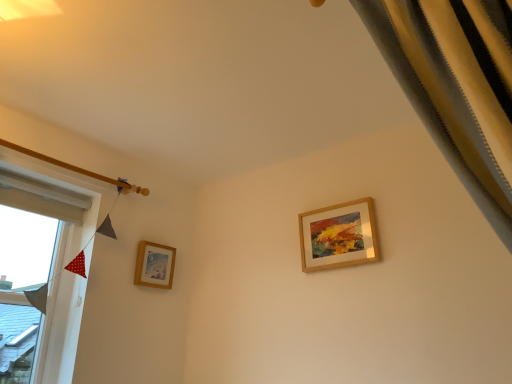
Looking at this image, measure the distance between wooden picture frame at lower left, the second picture frame positioned from the front, and camera.

The depth of wooden picture frame at lower left, the second picture frame positioned from the front, is 2.44 meters.

Find the location of a particular element. This screenshot has width=512, height=384. white fabric at left is located at coordinates (40, 274).

How different are the orientations of silky yellow curtain at upper right and white fabric at left in degrees?

silky yellow curtain at upper right and white fabric at left are facing 91.4 degrees away from each other.

Which is in front, silky yellow curtain at upper right or white fabric at left?

silky yellow curtain at upper right is closer to the camera.

Would you consider silky yellow curtain at upper right to be distant from white fabric at left?

silky yellow curtain at upper right is far away from white fabric at left.

Does point (462, 14) appear closer or farther from the camera than point (47, 338)?

Point (462, 14) is closer to the camera than point (47, 338).

Who is shorter, wooden picture frame at upper right, which is counted as the 1th picture frame, starting from the front, or silky yellow curtain at upper right?

With less height is wooden picture frame at upper right, which is counted as the 1th picture frame, starting from the front.

From the image's perspective, count 1st picture frames downward from the silky yellow curtain at upper right and point to it. Please provide its 2D coordinates.

[(339, 236)]

Between wooden picture frame at upper right, acting as the 2th picture frame starting from the left, and silky yellow curtain at upper right, which one appears on the left side from the viewer's perspective?

From the viewer's perspective, silky yellow curtain at upper right appears more on the left side.

From a real-world perspective, is wooden picture frame at lower left, the second picture frame positioned from the front, physically located above or below white fabric at left?

Clearly, from a real-world perspective, wooden picture frame at lower left, the second picture frame positioned from the front, is above white fabric at left.

Is wooden picture frame at lower left, acting as the 1th picture frame starting from the back, inside the boundaries of white fabric at left, or outside?

wooden picture frame at lower left, acting as the 1th picture frame starting from the back, is spatially situated outside white fabric at left.

How much distance is there between wooden picture frame at lower left, placed as the second picture frame when sorted from right to left, and white fabric at left?

wooden picture frame at lower left, placed as the second picture frame when sorted from right to left, is 20.14 inches away from white fabric at left.

Looking at the image, does wooden picture frame at lower left, acting as the 1th picture frame starting from the back, seem bigger or smaller compared to white fabric at left?

wooden picture frame at lower left, acting as the 1th picture frame starting from the back, is smaller than white fabric at left.

Does wooden picture frame at lower left, acting as the 1th picture frame starting from the back, turn towards wooden picture frame at upper right, the 1th picture frame in the right-to-left sequence?

Yes, wooden picture frame at lower left, acting as the 1th picture frame starting from the back, is facing wooden picture frame at upper right, the 1th picture frame in the right-to-left sequence.

Considering the relative sizes of wooden picture frame at lower left, acting as the 1th picture frame starting from the back, and wooden picture frame at upper right, which is counted as the 2th picture frame, starting from the back, in the image provided, is wooden picture frame at lower left, acting as the 1th picture frame starting from the back, thinner than wooden picture frame at upper right, which is counted as the 2th picture frame, starting from the back,?

No, wooden picture frame at lower left, acting as the 1th picture frame starting from the back, is not thinner than wooden picture frame at upper right, which is counted as the 2th picture frame, starting from the back.

From the image's perspective, which is above, wooden picture frame at lower left, placed as the second picture frame when sorted from right to left, or wooden picture frame at upper right, acting as the 2th picture frame starting from the left?

wooden picture frame at upper right, acting as the 2th picture frame starting from the left, from the image's perspective.

Is wooden picture frame at lower left, the second picture frame positioned from the front, further to camera compared to wooden picture frame at upper right, the 1th picture frame in the right-to-left sequence?

Yes, wooden picture frame at lower left, the second picture frame positioned from the front, is behind wooden picture frame at upper right, the 1th picture frame in the right-to-left sequence.

Consider the image. From a real-world perspective, is white fabric at left positioned over wooden picture frame at upper right, the 1th picture frame in the right-to-left sequence, based on gravity?

No, from a real-world perspective, white fabric at left is not above wooden picture frame at upper right, the 1th picture frame in the right-to-left sequence.

Is white fabric at left facing away from wooden picture frame at upper right, the 1th picture frame in the right-to-left sequence?

white fabric at left does not have its back to wooden picture frame at upper right, the 1th picture frame in the right-to-left sequence.

Considering the positions of points (37, 282) and (321, 208), is point (37, 282) closer to camera compared to point (321, 208)?

Yes, point (37, 282) is closer to viewer.

Locate an element on the screen. window that is under the wooden picture frame at upper right, the 1th picture frame in the right-to-left sequence (from a real-world perspective) is located at coordinates (40, 274).

Does silky yellow curtain at upper right turn towards wooden picture frame at upper right, which is counted as the 1th picture frame, starting from the front?

No, silky yellow curtain at upper right is not aimed at wooden picture frame at upper right, which is counted as the 1th picture frame, starting from the front.

Considering the sizes of silky yellow curtain at upper right and wooden picture frame at upper right, acting as the 2th picture frame starting from the left, in the image, is silky yellow curtain at upper right wider or thinner than wooden picture frame at upper right, acting as the 2th picture frame starting from the left,?

Considering their sizes, silky yellow curtain at upper right looks broader than wooden picture frame at upper right, acting as the 2th picture frame starting from the left.

Could you measure the distance between silky yellow curtain at upper right and wooden picture frame at upper right, which is counted as the 2th picture frame, starting from the back?

silky yellow curtain at upper right and wooden picture frame at upper right, which is counted as the 2th picture frame, starting from the back, are 4.08 feet apart from each other.

Which object is further away from the camera, silky yellow curtain at upper right or wooden picture frame at upper right, which is counted as the 1th picture frame, starting from the front?

wooden picture frame at upper right, which is counted as the 1th picture frame, starting from the front, is more distant.

From a real-world perspective, does wooden picture frame at upper right, acting as the 2th picture frame starting from the left, sit lower than white fabric at left?

Actually, wooden picture frame at upper right, acting as the 2th picture frame starting from the left, is physically above white fabric at left in the real world.

Are wooden picture frame at upper right, which is counted as the 2th picture frame, starting from the back, and white fabric at left far apart?

Yes, wooden picture frame at upper right, which is counted as the 2th picture frame, starting from the back, and white fabric at left are located far from each other.

Is wooden picture frame at upper right, which is counted as the 2th picture frame, starting from the back, bigger or smaller than white fabric at left?

wooden picture frame at upper right, which is counted as the 2th picture frame, starting from the back, is smaller than white fabric at left.

In order to click on window behind the silky yellow curtain at upper right in this screenshot , I will do `click(40, 274)`.

Image resolution: width=512 pixels, height=384 pixels. Find the location of `picture frame that is the 2nd object above the silky yellow curtain at upper right (from a real-world perspective)`. picture frame that is the 2nd object above the silky yellow curtain at upper right (from a real-world perspective) is located at coordinates (339, 236).

Which object lies nearer to the anchor point wooden picture frame at upper right, the 1th picture frame in the right-to-left sequence, wooden picture frame at lower left, the first picture frame in the left-to-right sequence, or white fabric at left?

wooden picture frame at lower left, the first picture frame in the left-to-right sequence, is positioned closer to the anchor wooden picture frame at upper right, the 1th picture frame in the right-to-left sequence.

When comparing their distances from white fabric at left, does silky yellow curtain at upper right or wooden picture frame at upper right, the 1th picture frame in the right-to-left sequence, seem further?

silky yellow curtain at upper right.

When comparing their distances from wooden picture frame at lower left, placed as the second picture frame when sorted from right to left, does white fabric at left or silky yellow curtain at upper right seem closer?

white fabric at left is positioned closer to the anchor wooden picture frame at lower left, placed as the second picture frame when sorted from right to left.

Estimate the real-world distances between objects in this image. Which object is closer to silky yellow curtain at upper right, wooden picture frame at lower left, the second picture frame positioned from the front, or wooden picture frame at upper right, acting as the 2th picture frame starting from the left?

Based on the image, wooden picture frame at upper right, acting as the 2th picture frame starting from the left, appears to be nearer to silky yellow curtain at upper right.

From the image, which object appears to be nearer to wooden picture frame at upper right, the 1th picture frame in the right-to-left sequence, silky yellow curtain at upper right or wooden picture frame at lower left, the second picture frame positioned from the front?

wooden picture frame at lower left, the second picture frame positioned from the front.

Based on their spatial positions, is white fabric at left or silky yellow curtain at upper right closer to wooden picture frame at upper right, the 1th picture frame in the right-to-left sequence?

Among the two, silky yellow curtain at upper right is located nearer to wooden picture frame at upper right, the 1th picture frame in the right-to-left sequence.

When comparing their distances from white fabric at left, does silky yellow curtain at upper right or wooden picture frame at lower left, acting as the 1th picture frame starting from the back, seem further?

silky yellow curtain at upper right lies further to white fabric at left than the other object.

Looking at the image, which one is located further to white fabric at left, wooden picture frame at lower left, the first picture frame in the left-to-right sequence, or silky yellow curtain at upper right?

Among the two, silky yellow curtain at upper right is located further to white fabric at left.

Image resolution: width=512 pixels, height=384 pixels. In order to click on picture frame between silky yellow curtain at upper right and wooden picture frame at lower left, the second picture frame positioned from the front, along the z-axis in this screenshot , I will do `click(339, 236)`.

Image resolution: width=512 pixels, height=384 pixels. Find the location of `picture frame between white fabric at left and wooden picture frame at upper right, which is counted as the 1th picture frame, starting from the front`. picture frame between white fabric at left and wooden picture frame at upper right, which is counted as the 1th picture frame, starting from the front is located at coordinates (155, 265).

Find the location of `curtain between white fabric at left and wooden picture frame at upper right, which is counted as the 2th picture frame, starting from the back`. curtain between white fabric at left and wooden picture frame at upper right, which is counted as the 2th picture frame, starting from the back is located at coordinates (456, 86).

The image size is (512, 384). Identify the location of window positioned between silky yellow curtain at upper right and wooden picture frame at lower left, the first picture frame in the left-to-right sequence, from near to far. (40, 274).